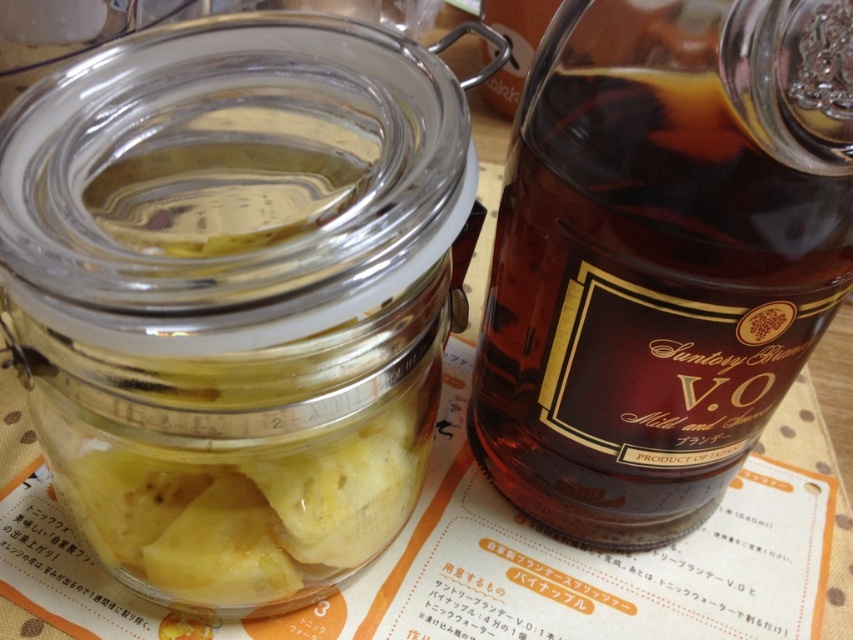
Does transparent glass jar at left have a greater width compared to brown glass bottle at right?

Yes.

Does point (310, 509) come closer to viewer compared to point (682, 45)?

No.

Which is behind, point (196, 608) or point (630, 88)?

The point (196, 608) is behind.

You are a GUI agent. You are given a task and a screenshot of the screen. Output one action in this format:
    pyautogui.click(x=<x>, y=<y>)
    Task: Click on the transparent glass jar at left
    
    Given the screenshot: What is the action you would take?
    pyautogui.click(x=236, y=294)